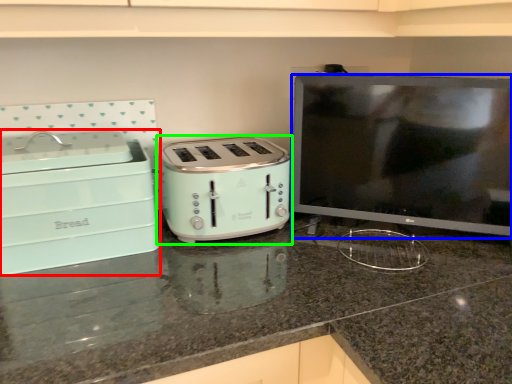
Question: Which object is the farthest from home appliance (highlighted by a red box)? Choose among these: appliance (highlighted by a blue box) or toaster (highlighted by a green box).

Choices:
 (A) appliance
 (B) toaster

Answer: (A)